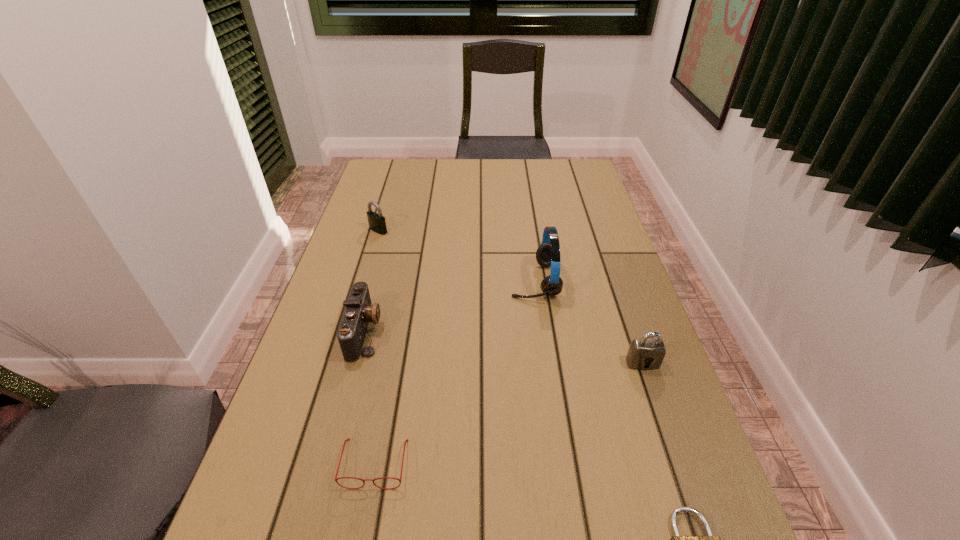
The image size is (960, 540). Identify the location of the fourth object from left to right. (548, 253).

Locate an element on the screen. the second farthest object is located at coordinates (548, 253).

Where is `the leftmost padlock`? This screenshot has height=540, width=960. the leftmost padlock is located at coordinates (377, 223).

You are a GUI agent. You are given a task and a screenshot of the screen. Output one action in this format:
    pyautogui.click(x=<x>, y=<y>)
    Task: Click on the farthest object
    
    Given the screenshot: What is the action you would take?
    pyautogui.click(x=377, y=223)

Identify the location of the second nearest padlock. The image size is (960, 540). (647, 353).

Locate an element on the screen. The width and height of the screenshot is (960, 540). camera is located at coordinates (359, 312).

The height and width of the screenshot is (540, 960). What are the coordinates of `the second shortest object` in the screenshot? It's located at (348, 439).

Locate an element on the screen. The image size is (960, 540). the fifth farthest object is located at coordinates (348, 439).

Where is `vacant space positioned with the microphone attached to the side of the tallest object`? The image size is (960, 540). vacant space positioned with the microphone attached to the side of the tallest object is located at coordinates click(x=478, y=281).

In order to click on vacant space located with the microphone attached to the side of the tallest object in this screenshot , I will do `click(470, 281)`.